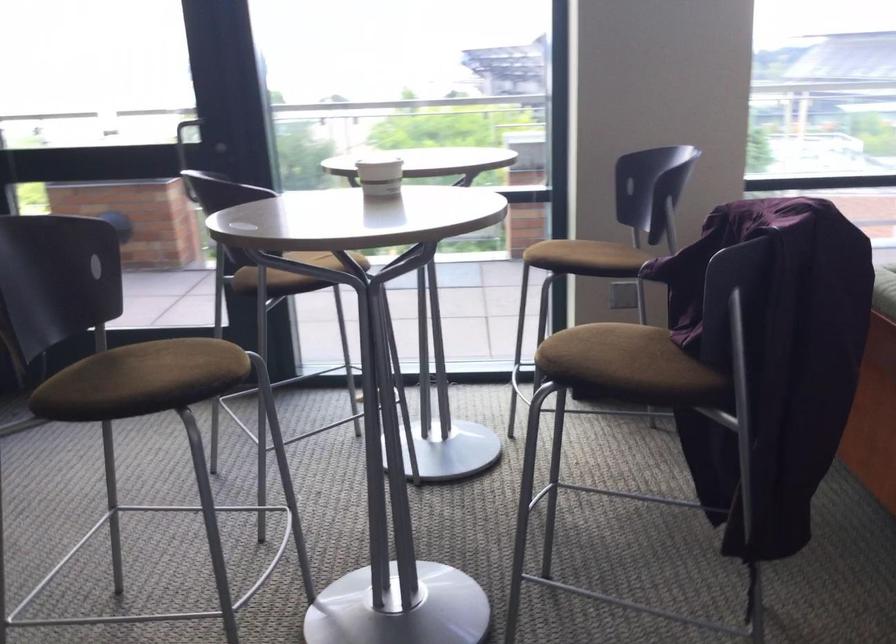
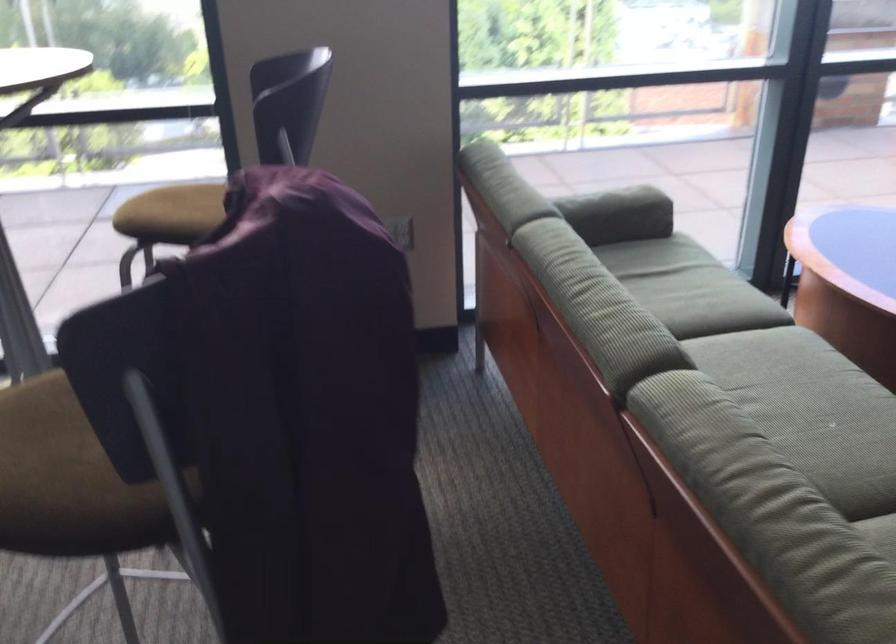
Which direction would the cameraman need to move to produce the second image?

The cameraman walked toward right, forward.